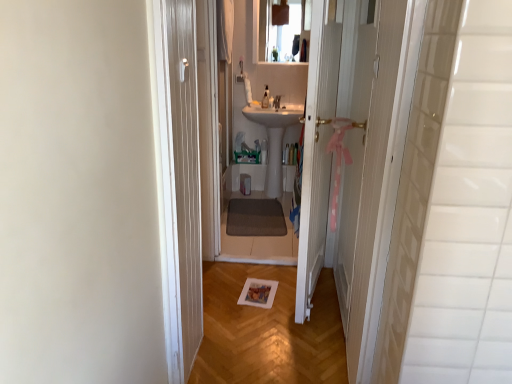
Question: Do you think white wooden door at center is within clear glass mirror at upper center, or outside of it?

Choices:
 (A) outside
 (B) inside

Answer: (A)

Question: Visually, is white wooden door at center positioned to the left or to the right of clear glass mirror at upper center?

Choices:
 (A) left
 (B) right

Answer: (B)

Question: Based on their relative distances, which object is farther from the white wooden door at center?

Choices:
 (A) clear glass mirror at upper center
 (B) pink ribbon at right
 (C) white glossy sink at center

Answer: (A)

Question: Estimate the real-world distances between objects in this image. Which object is closer to the white glossy sink at center?

Choices:
 (A) white wooden door at center
 (B) clear glass mirror at upper center
 (C) pink ribbon at right

Answer: (B)